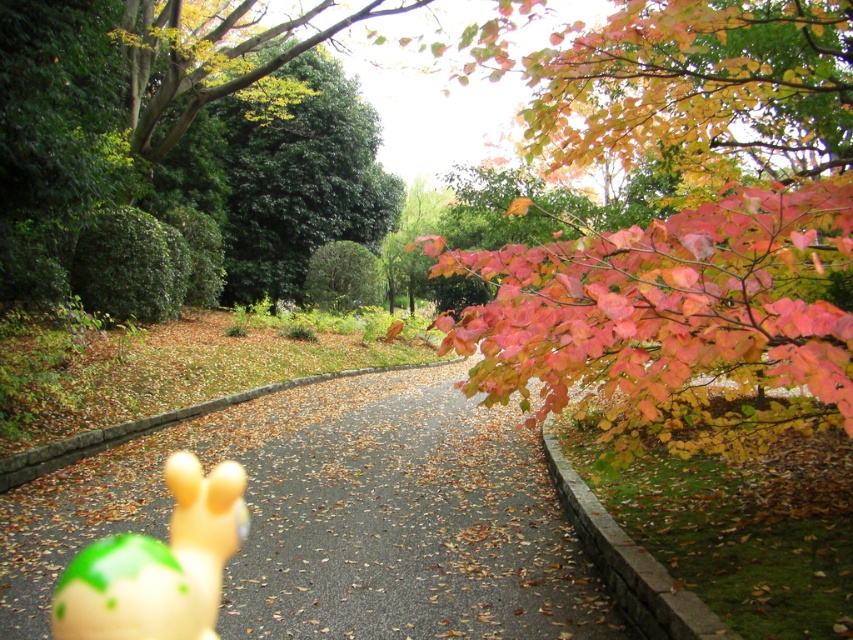
Does smooth asphalt road at center lie behind translucent yellow toy at center?

Yes.

Who is lower down, smooth asphalt road at center or translucent yellow toy at center?

translucent yellow toy at center is lower down.

Where is `smooth asphalt road at center`? This screenshot has width=853, height=640. smooth asphalt road at center is located at coordinates (338, 516).

What are the coordinates of `smooth asphalt road at center` in the screenshot? It's located at (338, 516).

Identify the location of shiny red leaves at upper right. The image size is (853, 640). (674, 321).

I want to click on shiny red leaves at upper right, so click(x=674, y=321).

From the picture: Does smooth asphalt road at center have a larger size compared to shiny red leaves at upper right?

Incorrect, smooth asphalt road at center is not larger than shiny red leaves at upper right.

From the picture: Who is positioned more to the right, smooth asphalt road at center or shiny red leaves at upper right?

Positioned to the right is shiny red leaves at upper right.

This screenshot has width=853, height=640. In order to click on smooth asphalt road at center in this screenshot , I will do `click(338, 516)`.